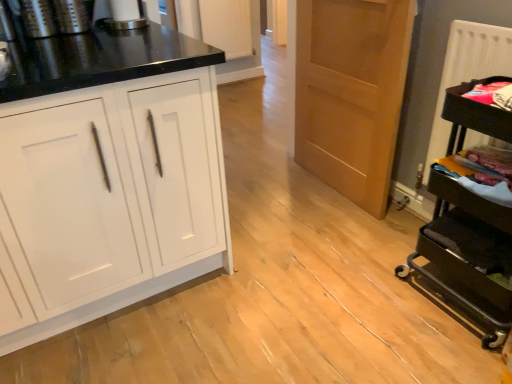
Question: Relative to white textured radiator at right, is white glossy cabinet at left in front or behind?

Choices:
 (A) front
 (B) behind

Answer: (A)

Question: Looking at their shapes, would you say white glossy cabinet at left is wider or thinner than white textured radiator at right?

Choices:
 (A) wide
 (B) thin

Answer: (A)

Question: Based on their relative distances, which object is nearer to the brushed metal coffee grinder at upper left, which is counted as the first appliance, starting from the left?

Choices:
 (A) white glossy cabinet at left
 (B) light brown wood door at center
 (C) black metal cart at right, the first appliance from the bottom
 (D) white textured radiator at right
 (E) brushed metal coffee maker at upper left, arranged as the third appliance when viewed from the right

Answer: (E)

Question: Which is nearer to the light brown wood door at center?

Choices:
 (A) white textured radiator at right
 (B) black metal cart at right, the first appliance from the bottom
 (C) white glossy paper towel dispenser at upper center, which is the 2th appliance in right-to-left order
 (D) white glossy cabinet at left
 (E) brushed metal coffee grinder at upper left, acting as the 4th appliance starting from the right

Answer: (A)